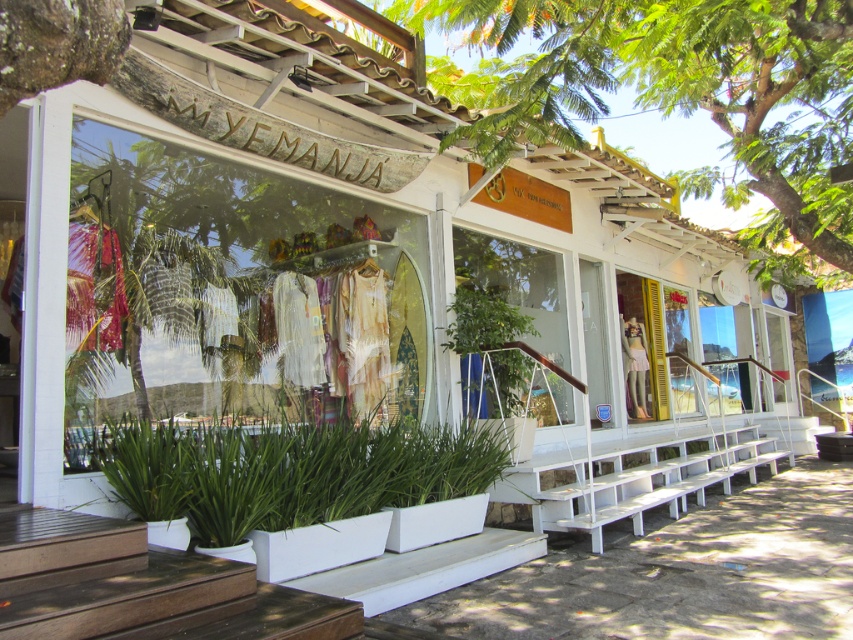
What are the coordinates of the matte glass shop window at center?

The coordinates of the matte glass shop window at center are point (233, 292).

You are a window cleaner standing in front of the storefront. You need to clean both the green leafy tree at upper center and the green leafy plant at lower center. Which one will require you to use a taller ladder?

The green leafy tree at upper center requires a taller ladder because it has a greater height compared to the green leafy plant at lower center.

You are a delivery person who needs to place a 3.5 meter long ladder against the storefront to clean the green leafy tree at upper center. The ladder must be placed near the matte glass shop window at center. Is the distance between the two objects sufficient for the ladder to reach the tree without extending beyond the window?

The distance between the matte glass shop window at center and the green leafy tree at upper center is 3.57 meters. Since the ladder is 3.5 meters long, it can be placed near the window and will be just short of reaching the tree, as 3.5 meters is slightly less than the required 3.57 meters. Therefore, the ladder will not be long enough to reach the tree without extending beyond the window.